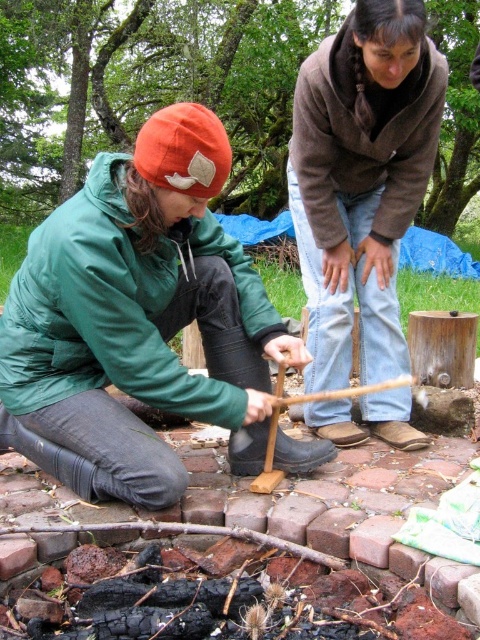
Does matte green jacket at center have a lesser width compared to brown fuzzy sweater at upper center?

Incorrect, matte green jacket at center's width is not less than brown fuzzy sweater at upper center's.

Between point (169, 298) and point (402, 173), which one is positioned in front?

Positioned in front is point (169, 298).

Image resolution: width=480 pixels, height=640 pixels. Find the location of `matte green jacket at center`. matte green jacket at center is located at coordinates (137, 320).